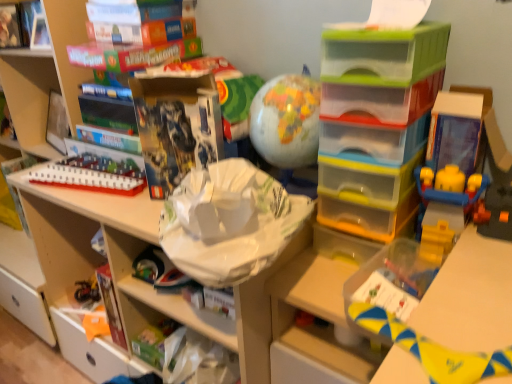
Question: Would you say white paper bag at upper center, which appears as the fourth book when viewed from the left, is a long distance from translucent plastic drawers at center, marked as the 2th shelf in a left-to-right arrangement?

Choices:
 (A) yes
 (B) no

Answer: (B)

Question: From the image's perspective, does white paper bag at upper center, the 2th book positioned from the right, appear higher than translucent plastic drawers at center, marked as the 2th shelf in a left-to-right arrangement?

Choices:
 (A) yes
 (B) no

Answer: (B)

Question: Does white paper bag at upper center, which appears as the fourth book when viewed from the left, have a greater width compared to translucent plastic drawers at center, which is the first shelf from right to left?

Choices:
 (A) yes
 (B) no

Answer: (B)

Question: Is white paper bag at upper center, the 2th book positioned from the right, oriented away from translucent plastic drawers at center, marked as the 2th shelf in a left-to-right arrangement?

Choices:
 (A) yes
 (B) no

Answer: (B)

Question: Is white paper bag at upper center, which appears as the fourth book when viewed from the left, bigger than translucent plastic drawers at center, which is the first shelf from right to left?

Choices:
 (A) yes
 (B) no

Answer: (B)

Question: Is white paper bag at upper center, the 2th book positioned from the right, to the left of translucent plastic drawers at center, marked as the 2th shelf in a left-to-right arrangement, from the viewer's perspective?

Choices:
 (A) no
 (B) yes

Answer: (B)

Question: Is hardcover book at upper left, marked as the 4th book in a right-to-left arrangement, looking in the opposite direction of yellow fabric toy at lower right, the third toy positioned from the back?

Choices:
 (A) no
 (B) yes

Answer: (A)

Question: Is hardcover book at upper left, marked as the 4th book in a right-to-left arrangement, bigger than yellow fabric toy at lower right, which is the third toy in top-to-bottom order?

Choices:
 (A) no
 (B) yes

Answer: (B)

Question: Considering the relative positions of hardcover book at upper left, marked as the second book in a left-to-right arrangement, and yellow fabric toy at lower right, which is the third toy in top-to-bottom order, in the image provided, is hardcover book at upper left, marked as the second book in a left-to-right arrangement, to the right of yellow fabric toy at lower right, which is the third toy in top-to-bottom order, from the viewer's perspective?

Choices:
 (A) yes
 (B) no

Answer: (B)

Question: Does hardcover book at upper left, marked as the 4th book in a right-to-left arrangement, have a greater width compared to yellow fabric toy at lower right, which ranks as the 3th toy in left-to-right order?

Choices:
 (A) yes
 (B) no

Answer: (B)

Question: Are hardcover book at upper left, marked as the 4th book in a right-to-left arrangement, and yellow fabric toy at lower right, which ranks as the 3th toy in left-to-right order, far apart?

Choices:
 (A) no
 (B) yes

Answer: (B)

Question: From a real-world perspective, is hardcover book at upper left, marked as the 4th book in a right-to-left arrangement, located higher than yellow fabric toy at lower right, the first toy viewed from the front?

Choices:
 (A) yes
 (B) no

Answer: (A)

Question: From a real-world perspective, is white plastic train at upper left, which ranks as the third toy in right-to-left order, physically above matte cardboard book at upper left, the 3th book from the right?

Choices:
 (A) yes
 (B) no

Answer: (B)